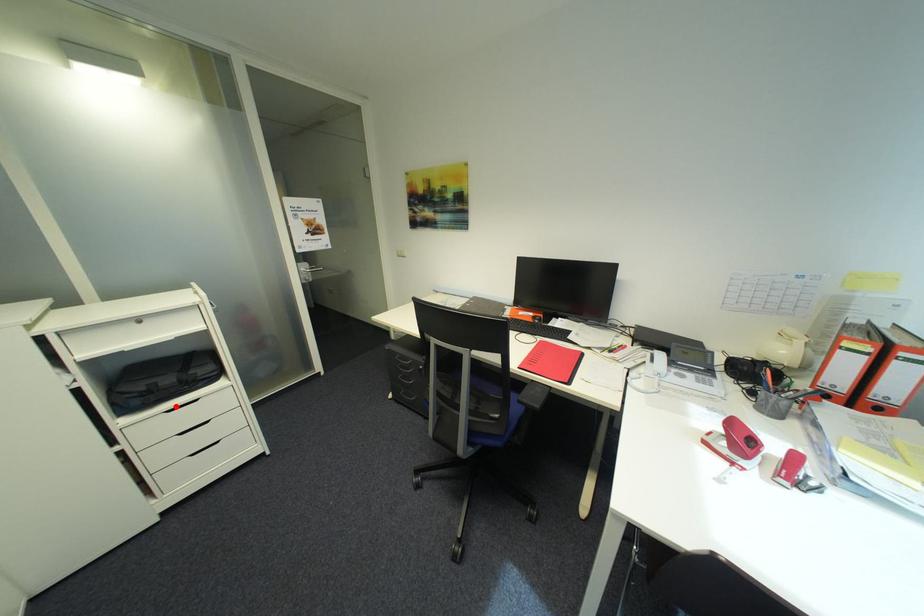
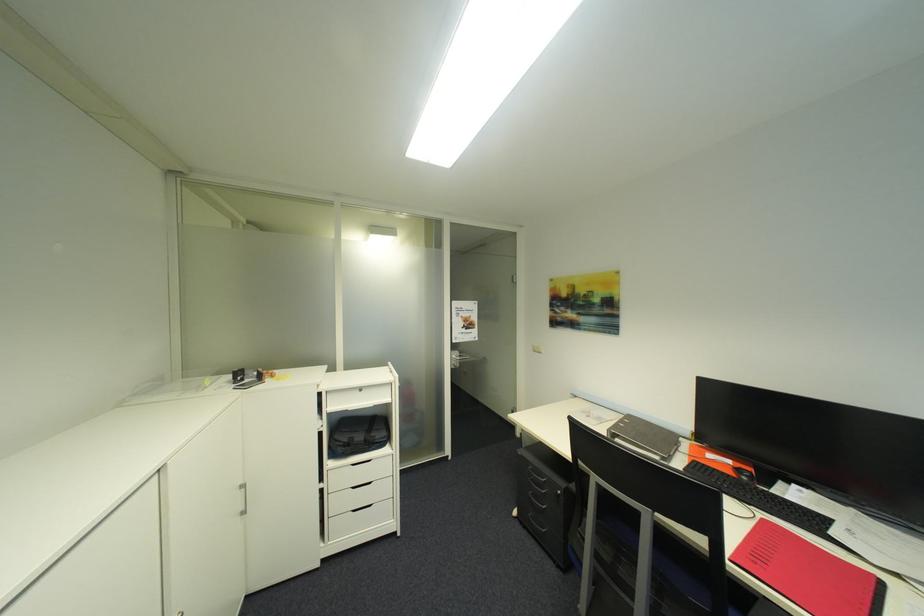
Where in the second image is the point corresponding to the highlighted location from the first image?

(362, 461)